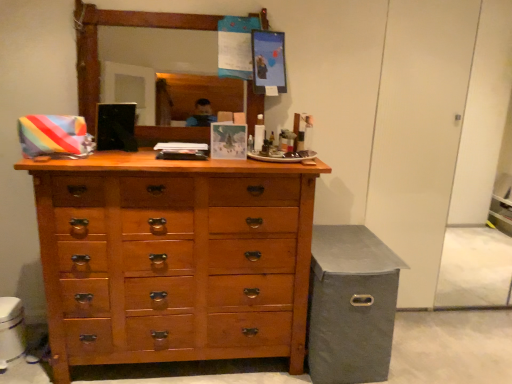
The height and width of the screenshot is (384, 512). What are the coordinates of `vacant space to the right of gray fabric storage bin at lower right` in the screenshot? It's located at (426, 346).